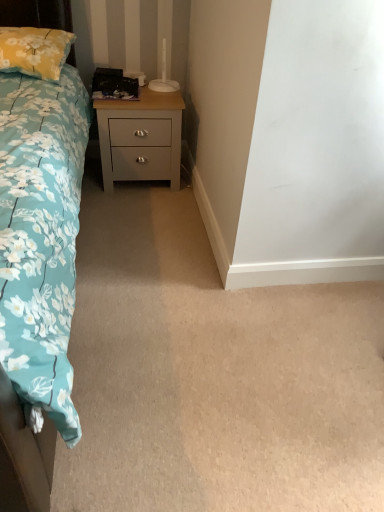
Question: From their relative heights in the image, would you say satin gray wood nightstand at center is taller or shorter than yellow floral pillow at upper left?

Choices:
 (A) tall
 (B) short

Answer: (A)

Question: From the image's perspective, is satin gray wood nightstand at center positioned above or below yellow floral pillow at upper left?

Choices:
 (A) below
 (B) above

Answer: (A)

Question: Estimate the real-world distances between objects in this image. Which object is closer to the satin gray wood nightstand at center?

Choices:
 (A) yellow floral pillow at upper left
 (B) blue floral fabric bed at left

Answer: (A)

Question: Which object is positioned farthest from the yellow floral pillow at upper left?

Choices:
 (A) satin gray wood nightstand at center
 (B) blue floral fabric bed at left

Answer: (B)